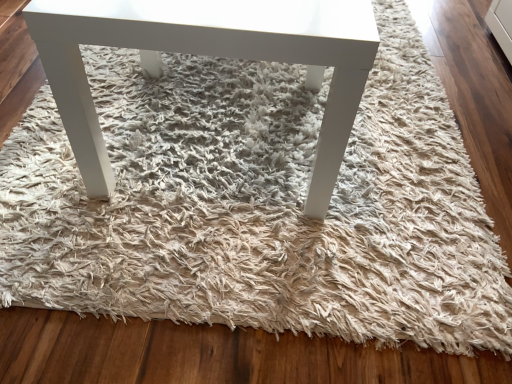
Find the location of a particular element. This screenshot has width=512, height=384. vacant region to the right of white matte table at center is located at coordinates (410, 165).